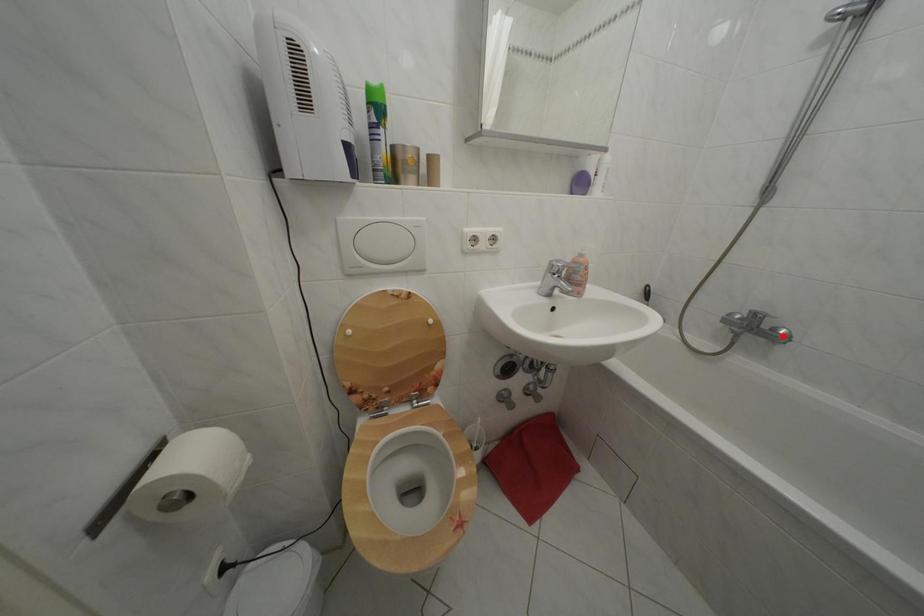
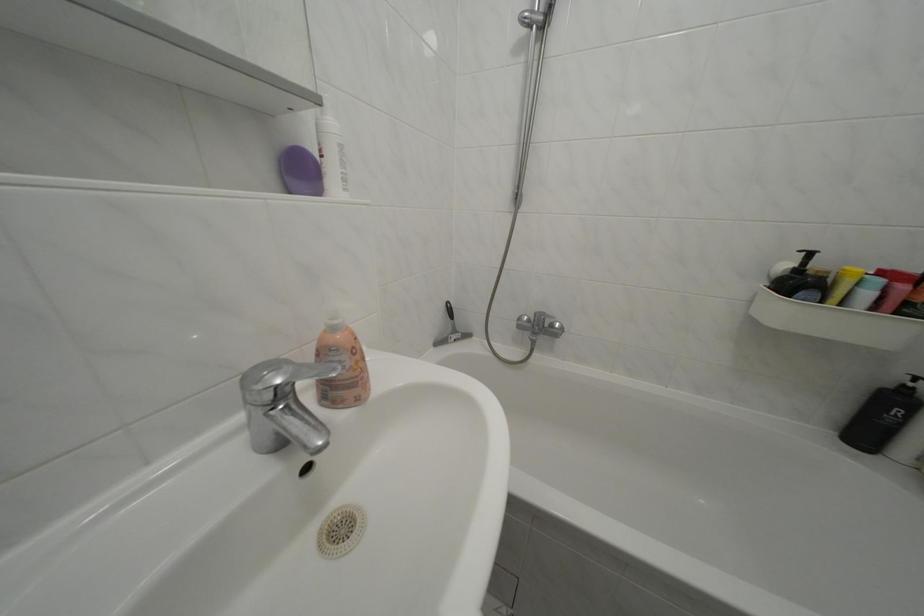
Find the pixel in the second image that matches the highlighted location in the first image.

(562, 331)